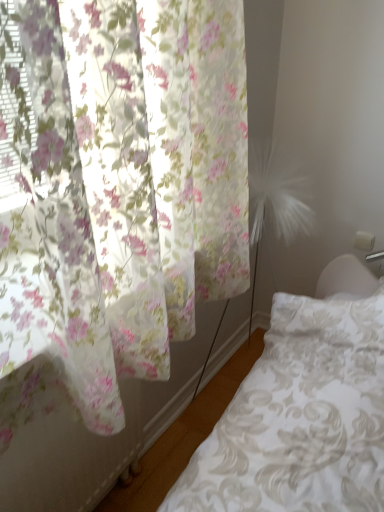
This screenshot has width=384, height=512. I want to click on sheer floral fabric at left, so click(x=117, y=187).

Image resolution: width=384 pixels, height=512 pixels. Describe the element at coordinates (117, 187) in the screenshot. I see `sheer floral fabric at left` at that location.

Identify the location of sheer floral fabric at left. This screenshot has width=384, height=512. (117, 187).